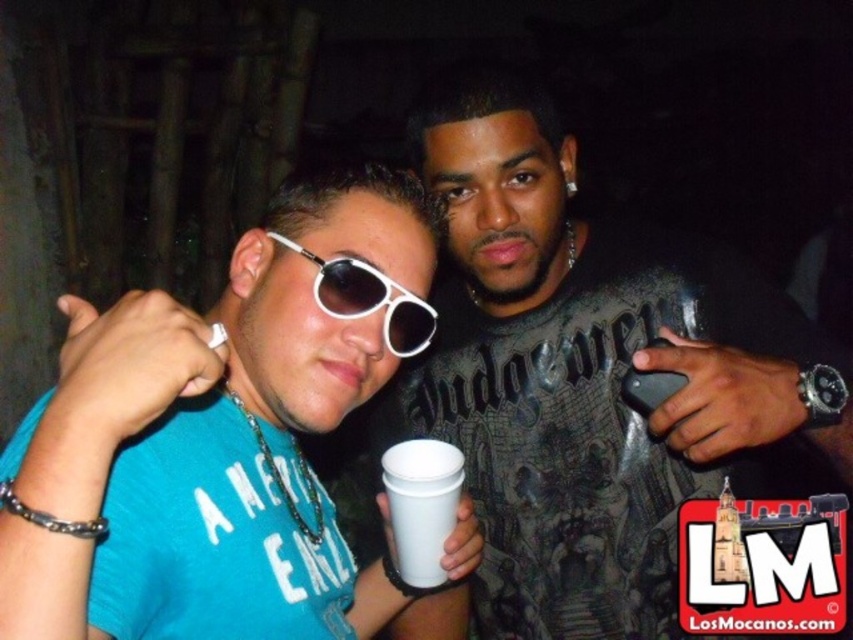
You are at a party and want to grab the white plastic sunglasses at center. However, there is a white paper cup at center in the way. Can you reach the sunglasses without moving the cup?

The white paper cup at center is to the right of the white plastic sunglasses at center, so you can reach the sunglasses by moving your hand to the left side of the cup.

You are trying to see the person behind the white paper cup at center. Can you see the white plastic sunglasses at center through the cup?

The white plastic sunglasses at center is behind white paper cup at center, so you cannot see the white plastic sunglasses at center through the white paper cup at center.